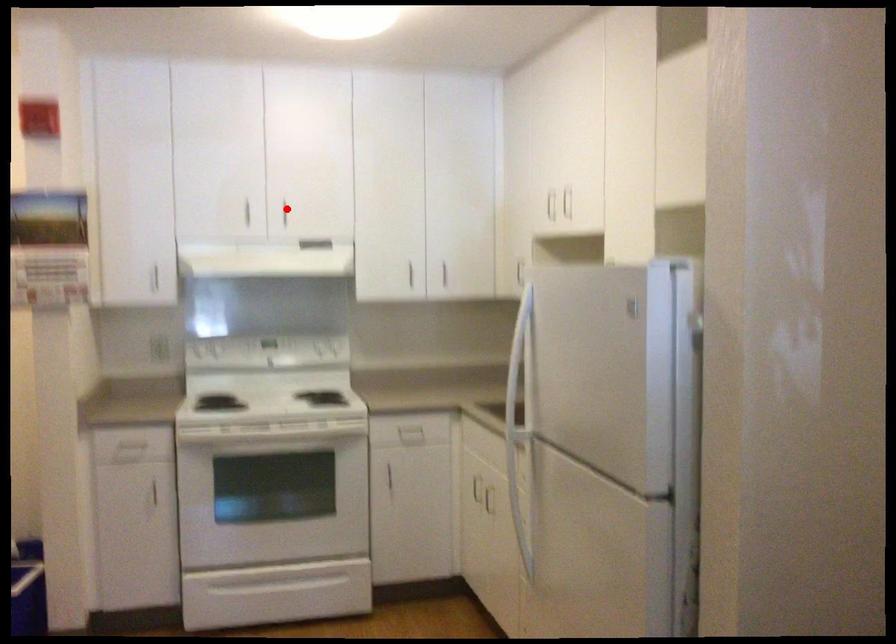
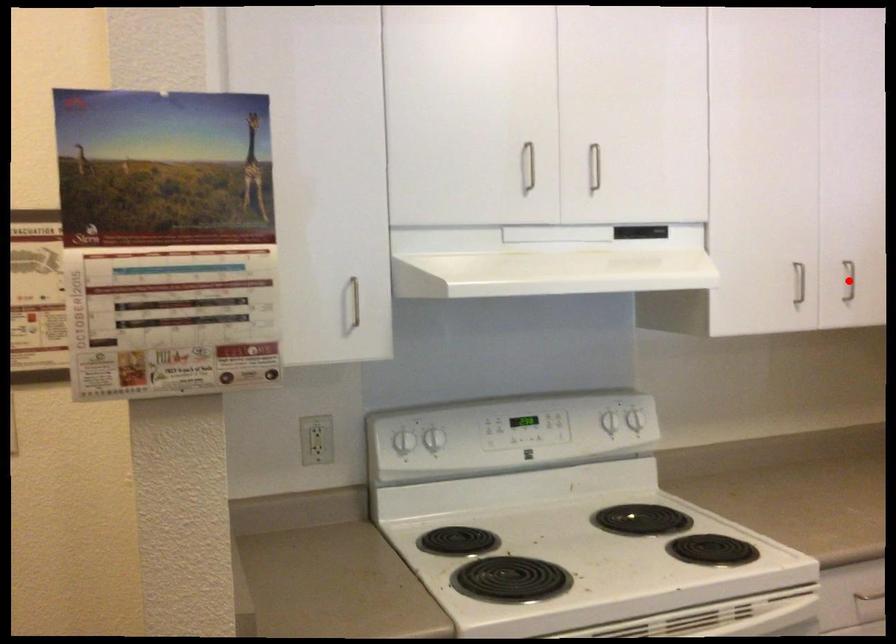
I am providing you with two images of the same scene from different viewpoints. A red point is marked on the first image and another point is marked on the second image. Do the highlighted points in image1 and image2 indicate the same real-world spot?

No